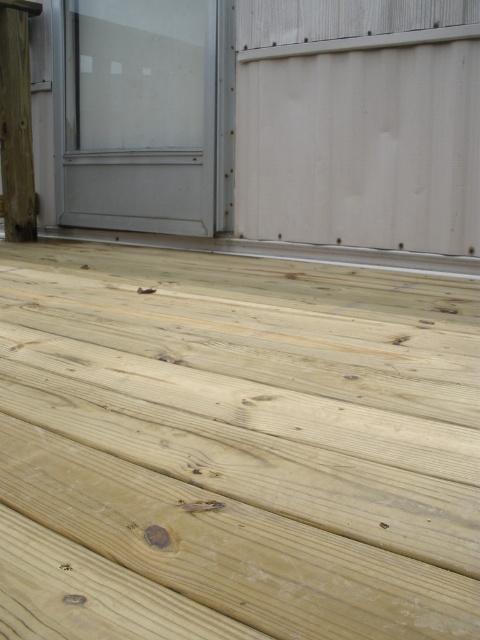
Question: Can you confirm if natural wood deck at center is positioned to the left of natural wood post at left?

Choices:
 (A) yes
 (B) no

Answer: (B)

Question: Which point is closer to the camera taking this photo?

Choices:
 (A) (15, 202)
 (B) (422, 465)

Answer: (B)

Question: Observing the image, what is the correct spatial positioning of natural wood deck at center in reference to natural wood post at left?

Choices:
 (A) below
 (B) above

Answer: (A)

Question: Among these objects, which one is farthest from the camera?

Choices:
 (A) natural wood deck at center
 (B) natural wood post at left

Answer: (B)

Question: Is natural wood deck at center further to camera compared to natural wood post at left?

Choices:
 (A) yes
 (B) no

Answer: (B)